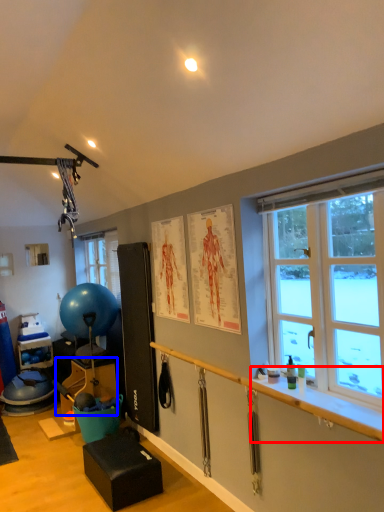
Question: Which point is closer to the camera, window sill (highlighted by a red box) or furniture (highlighted by a blue box)?

Choices:
 (A) window sill
 (B) furniture

Answer: (A)